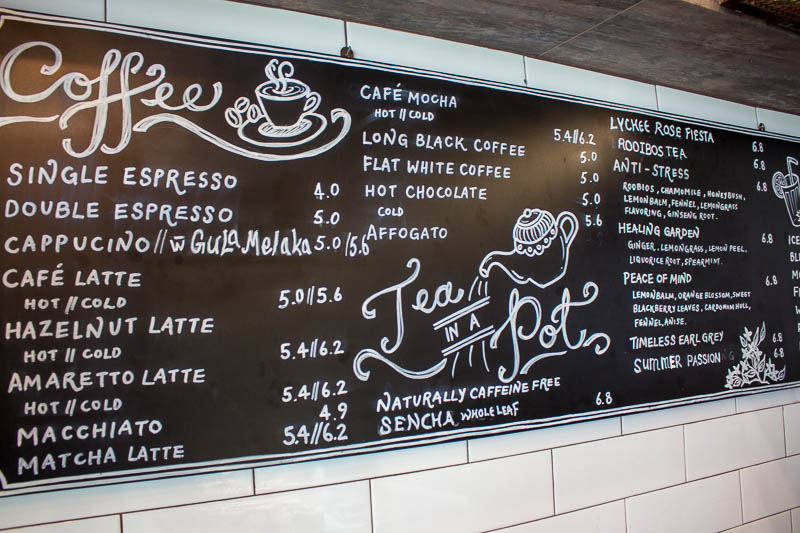
Find the location of a particular element. glass is located at coordinates (794, 204).